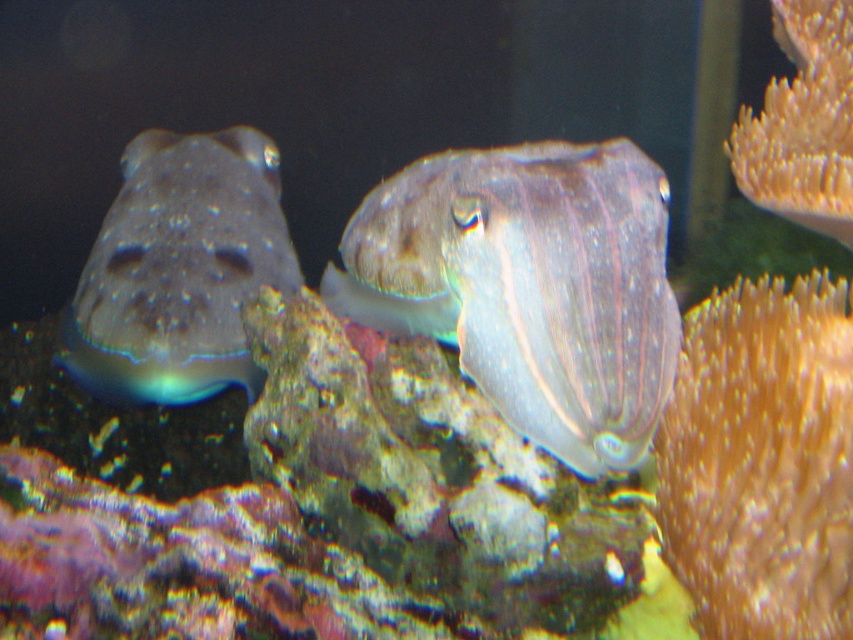
Is translucent rubber squid at center taller than orange soft coral at right?

Correct, translucent rubber squid at center is much taller as orange soft coral at right.

Is translucent rubber squid at center below orange soft coral at right?

Incorrect, translucent rubber squid at center is not positioned below orange soft coral at right.

At what (x,y) coordinates should I click in order to perform the action: click on translucent rubber squid at center. Please return your answer as a coordinate pair (x, y). Looking at the image, I should click on (531, 285).

Between translucent rubber fish at left and yellow frilly coral at upper right, which one appears on the left side from the viewer's perspective?

Positioned to the left is translucent rubber fish at left.

Which is above, translucent rubber fish at left or yellow frilly coral at upper right?

yellow frilly coral at upper right is above.

The height and width of the screenshot is (640, 853). Identify the location of translucent rubber fish at left. (180, 268).

Can you confirm if orange soft coral at right is thinner than translucent rubber fish at left?

Yes, orange soft coral at right is thinner than translucent rubber fish at left.

The image size is (853, 640). I want to click on orange soft coral at right, so click(x=762, y=461).

Who is more forward, (782, 616) or (189, 168)?

Point (782, 616) is more forward.

Image resolution: width=853 pixels, height=640 pixels. What are the coordinates of `orange soft coral at right` in the screenshot? It's located at (762, 461).